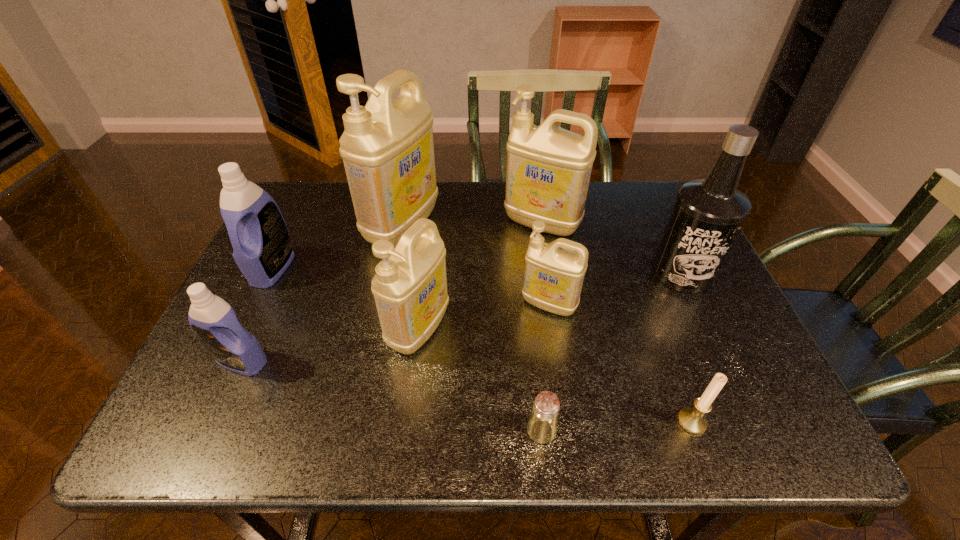
Locate an element on the screen. candle holder that is at the near edge is located at coordinates (692, 420).

At what (x,y) coordinates should I click in order to perform the action: click on saltshaker that is at the near edge. Please return your answer as a coordinate pair (x, y). The image size is (960, 540). Looking at the image, I should click on (542, 425).

At what (x,y) coordinates should I click in order to perform the action: click on liquor at the right edge. Please return your answer as a coordinate pair (x, y). The height and width of the screenshot is (540, 960). Looking at the image, I should click on (708, 213).

At what (x,y) coordinates should I click in order to perform the action: click on candle holder at the right edge. Please return your answer as a coordinate pair (x, y). Looking at the image, I should click on (x=692, y=420).

Identify the location of object located at the near right corner. This screenshot has width=960, height=540. (692, 420).

Where is `free space at the far edge of the desktop`? free space at the far edge of the desktop is located at coordinates (495, 193).

In the image, there is a desktop. Identify the location of blank space at the near edge. Image resolution: width=960 pixels, height=540 pixels. (649, 446).

In the image, there is a desktop. Where is `free space at the right edge`? The height and width of the screenshot is (540, 960). free space at the right edge is located at coordinates (688, 369).

Find the location of a particular element. free space at the far left corner of the desktop is located at coordinates (303, 211).

Identify the location of free area in between the eighth object from left to right and the smaller blue detergent. (467, 392).